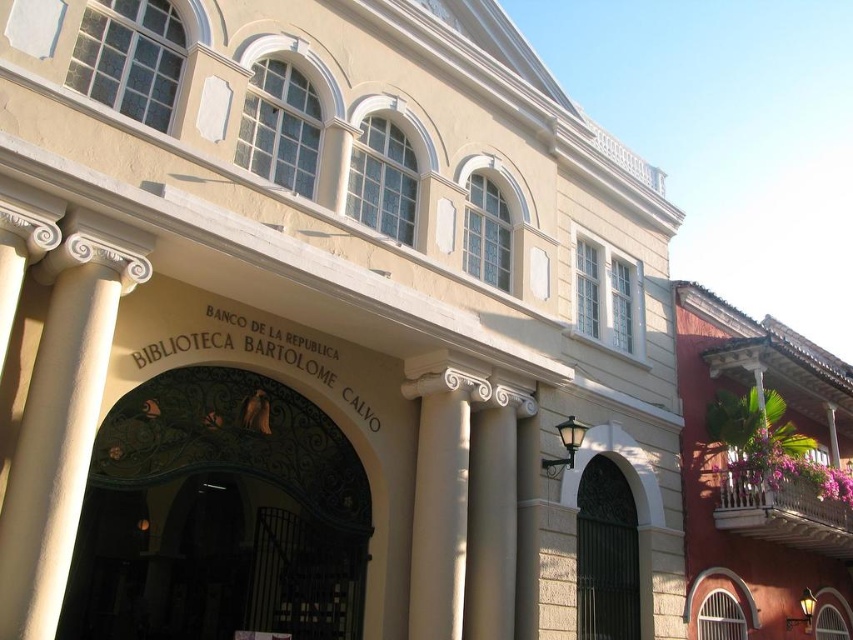
From the picture: Does white glossy column at center have a lesser width compared to white marble column at center?

Correct, white glossy column at center's width is less than white marble column at center's.

Is white glossy column at center to the left of white marble column at center from the viewer's perspective?

Yes, white glossy column at center is to the left of white marble column at center.

What do you see at coordinates (62, 417) in the screenshot?
I see `white glossy column at center` at bounding box center [62, 417].

What are the coordinates of `white glossy column at center` in the screenshot? It's located at (62, 417).

Does white stone column at center appear under dark metal gate at center?

Yes.

Describe the element at coordinates (492, 515) in the screenshot. I see `white stone column at center` at that location.

You are a GUI agent. You are given a task and a screenshot of the screen. Output one action in this format:
    pyautogui.click(x=<x>, y=<y>)
    Task: Click on the white stone column at center
    The height and width of the screenshot is (640, 853).
    Given the screenshot: What is the action you would take?
    pyautogui.click(x=492, y=515)

In order to click on white stone column at center in this screenshot , I will do `click(492, 515)`.

Can you confirm if green wrought iron arch at center is thinner than white stone column at center?

In fact, green wrought iron arch at center might be wider than white stone column at center.

Identify the location of green wrought iron arch at center. The image size is (853, 640). (218, 515).